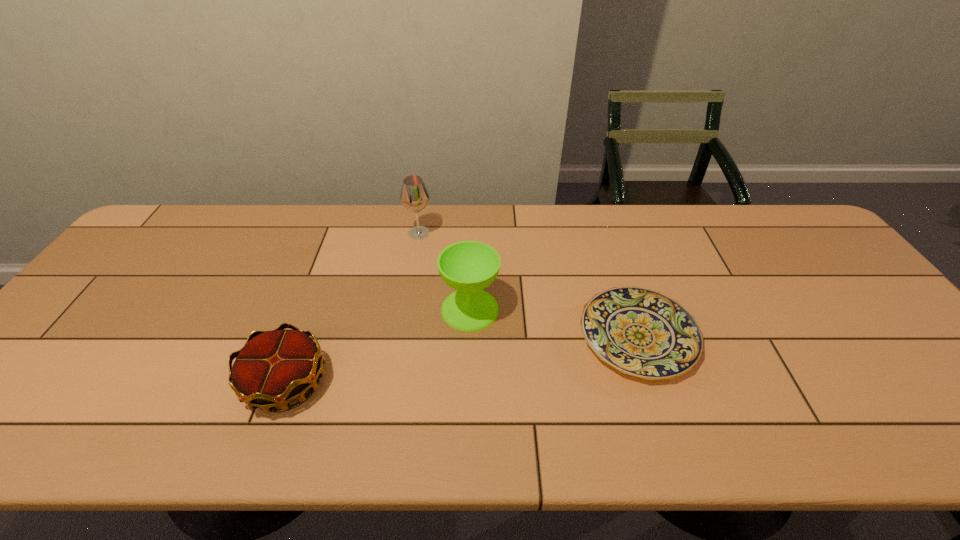
I want to click on object that is the second closest to the second shortest object, so click(x=414, y=196).

Locate an element on the screen. This screenshot has height=540, width=960. object identified as the third closest to the second shortest object is located at coordinates (640, 332).

I want to click on vacant space that satisfies the following two spatial constraints: 1. on the back side of the right wineglass; 2. on the left side of the crown, so click(x=313, y=309).

Image resolution: width=960 pixels, height=540 pixels. Identify the location of free spot that satisfies the following two spatial constraints: 1. on the front side of the right wineglass; 2. on the left side of the left wineglass. (407, 309).

Where is `free location that satisfies the following two spatial constraints: 1. on the front side of the right wineglass; 2. on the right side of the rightmost object`? The height and width of the screenshot is (540, 960). free location that satisfies the following two spatial constraints: 1. on the front side of the right wineglass; 2. on the right side of the rightmost object is located at coordinates (469, 336).

I want to click on free region that satisfies the following two spatial constraints: 1. on the front side of the right wineglass; 2. on the left side of the shortest object, so click(469, 336).